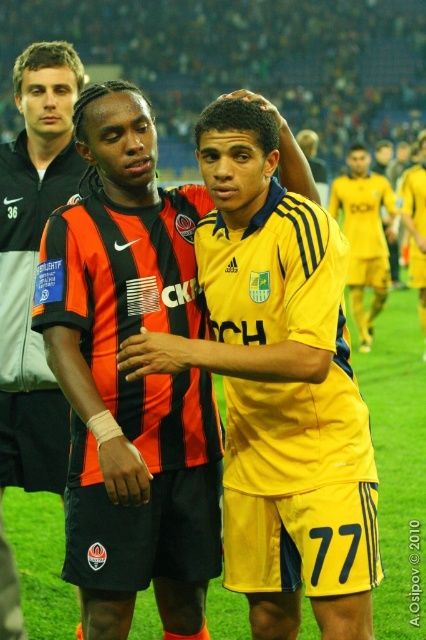
Question: Considering the relative positions of orange and black jersey at left and yellow jersey at center in the image provided, where is orange and black jersey at left located with respect to yellow jersey at center?

Choices:
 (A) below
 (B) above

Answer: (A)

Question: Is orange and black jersey at left wider than yellow jersey at center?

Choices:
 (A) yes
 (B) no

Answer: (B)

Question: Which of the following is the closest to the observer?

Choices:
 (A) yellow jersey at center
 (B) orange and black jersey at left

Answer: (B)

Question: Can you confirm if orange and black jersey at left is smaller than yellow jersey at center?

Choices:
 (A) yes
 (B) no

Answer: (A)